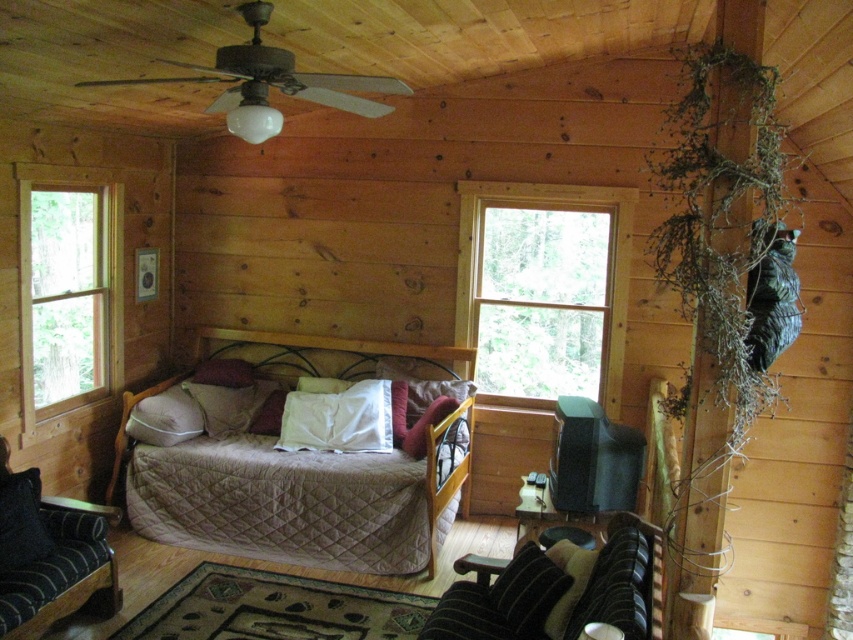
Does quilted beige bed at center appear on the right side of soft white pillow at center?

Indeed, quilted beige bed at center is positioned on the right side of soft white pillow at center.

Who is shorter, quilted beige bed at center or soft white pillow at center?

With less height is soft white pillow at center.

Which is in front, point (289, 522) or point (136, 419)?

Point (289, 522) is in front.

At what (x,y) coordinates should I click in order to perform the action: click on quilted beige bed at center. Please return your answer as a coordinate pair (x, y). The image size is (853, 640). Looking at the image, I should click on (292, 502).

Consider the image. Which is above, quilted beige bed at center or clear glass window at left?

clear glass window at left is higher up.

At what (x,y) coordinates should I click in order to perform the action: click on quilted beige bed at center. Please return your answer as a coordinate pair (x, y). This screenshot has width=853, height=640. Looking at the image, I should click on (292, 502).

Is quilted beige bed at center wider than white matte pillow at center?

Indeed, quilted beige bed at center has a greater width compared to white matte pillow at center.

Locate an element on the screen. quilted beige bed at center is located at coordinates (292, 502).